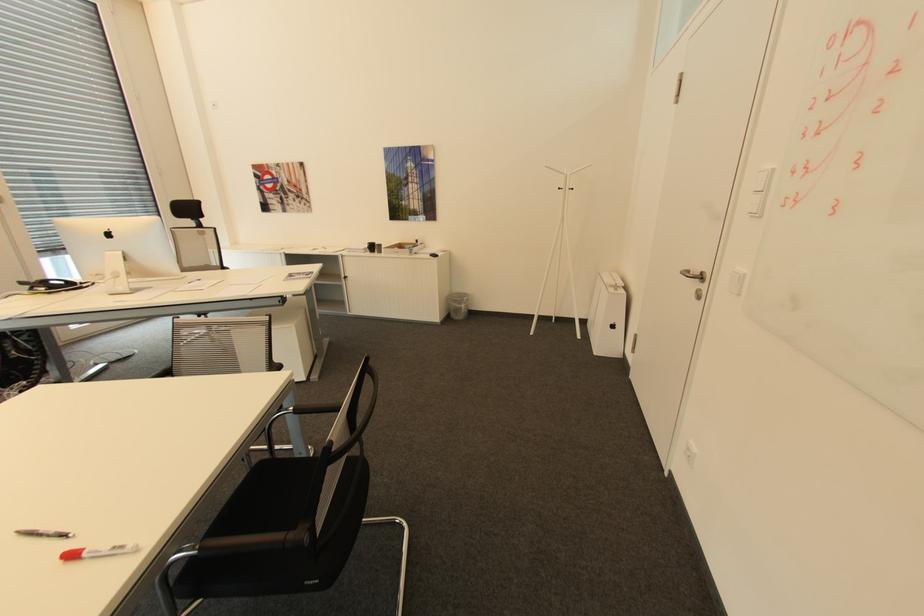
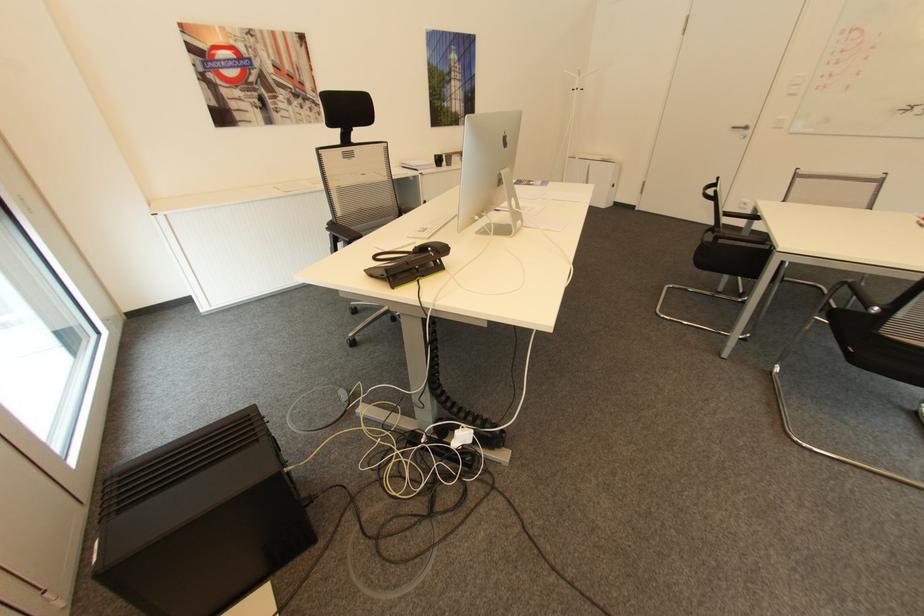
Locate, in the second image, the point that corresponds to the point at 706,277 in the first image.

(749, 128)